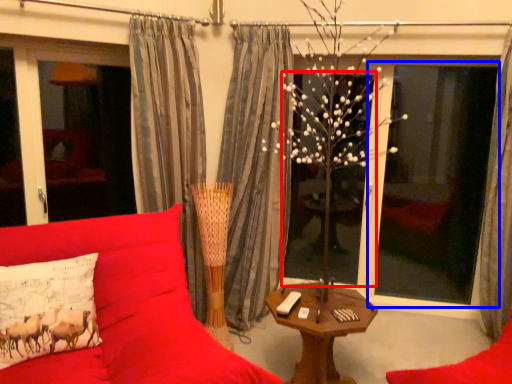
Question: Which object appears farthest to the camera in this image, window (highlighted by a red box) or window screen (highlighted by a blue box)?

Choices:
 (A) window
 (B) window screen

Answer: (A)